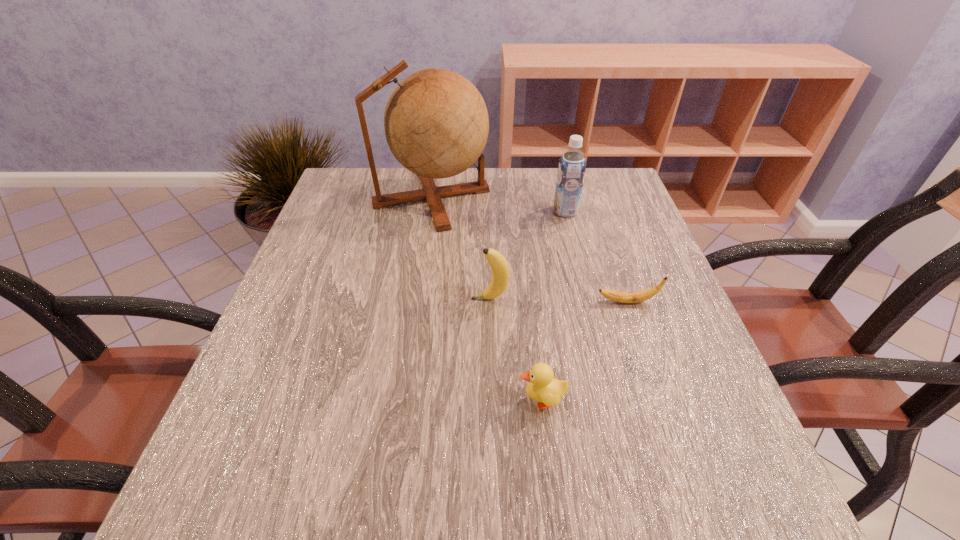
Where is `vacant space situated on the peel of the shorter banana from the top`? vacant space situated on the peel of the shorter banana from the top is located at coordinates (403, 302).

Identify the location of globe located in the far edge section of the desktop. pyautogui.click(x=436, y=123).

Image resolution: width=960 pixels, height=540 pixels. What are the coordinates of `soya milk at the far edge` in the screenshot? It's located at (571, 171).

Locate an element on the screen. object situated at the left edge is located at coordinates pyautogui.click(x=436, y=123).

You are a GUI agent. You are given a task and a screenshot of the screen. Output one action in this format:
    pyautogui.click(x=<x>, y=<y>)
    Task: Click on the soya milk situated at the right edge
    This screenshot has width=960, height=540.
    Given the screenshot: What is the action you would take?
    pyautogui.click(x=571, y=171)

At what (x,y) coordinates should I click in order to perform the action: click on banana positioned at the right edge. Please return your answer as a coordinate pair (x, y). Looking at the image, I should click on (618, 296).

You are a GUI agent. You are given a task and a screenshot of the screen. Output one action in this format:
    pyautogui.click(x=<x>, y=<y>)
    Task: Click on the object at the far left corner
    The image size is (960, 540).
    Given the screenshot: What is the action you would take?
    pyautogui.click(x=436, y=123)

Find the location of a particular element. This screenshot has height=540, width=960. object that is at the far right corner is located at coordinates (571, 171).

This screenshot has height=540, width=960. I want to click on vacant space at the far edge of the desktop, so click(396, 188).

Find the location of a particular element. free space at the near edge is located at coordinates pyautogui.click(x=520, y=511).